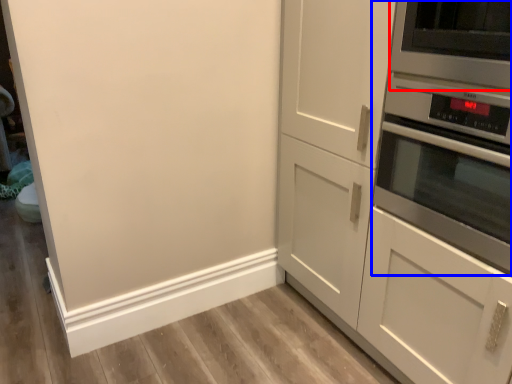
Question: Among these objects, which one is nearest to the camera, appliance (highlighted by a red box) or home appliance (highlighted by a blue box)?

Choices:
 (A) appliance
 (B) home appliance

Answer: (B)